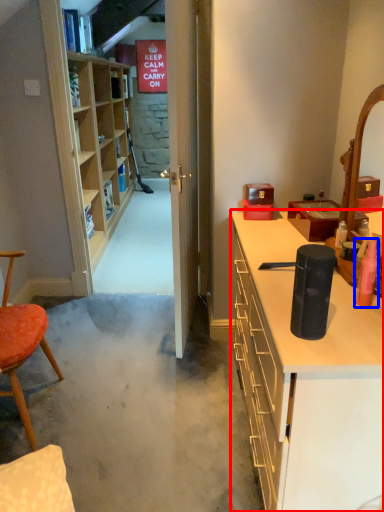
Question: Which of the following is the farthest to the observer, cabinetry (highlighted by a red box) or toiletry (highlighted by a blue box)?

Choices:
 (A) cabinetry
 (B) toiletry

Answer: (B)